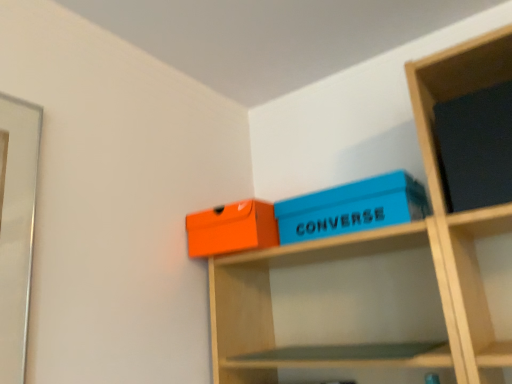
What is the approximate width of matte orange box at upper center, the 1th box viewed from the left?

It is 4.08 inches.

Locate an element on the screen. matte orange box at upper center, arranged as the second box when viewed from the right is located at coordinates (232, 228).

Could you measure the distance between blue matte shoebox at upper center, which ranks as the first box in right-to-left order, and matte orange box at upper center, the 1th box viewed from the left?

6.45 inches.

Does blue matte shoebox at upper center, which is counted as the 2th box, starting from the left, have a smaller size compared to matte orange box at upper center, the 1th box viewed from the left?

No, blue matte shoebox at upper center, which is counted as the 2th box, starting from the left, is not smaller than matte orange box at upper center, the 1th box viewed from the left.

Is blue matte shoebox at upper center, which ranks as the first box in right-to-left order, looking in the opposite direction of matte orange box at upper center, arranged as the second box when viewed from the right?

No, blue matte shoebox at upper center, which ranks as the first box in right-to-left order, is not facing the opposite direction of matte orange box at upper center, arranged as the second box when viewed from the right.

Which object is positioned more to the left, blue matte shoebox at upper center, which is counted as the 2th box, starting from the left, or matte orange box at upper center, arranged as the second box when viewed from the right?

matte orange box at upper center, arranged as the second box when viewed from the right, is more to the left.

Based on the photo, between matte orange box at upper center, the 1th box viewed from the left, and blue matte shoebox at upper center, which is counted as the 2th box, starting from the left, which one appears on the left side from the viewer's perspective?

Positioned to the left is matte orange box at upper center, the 1th box viewed from the left.

Based on their sizes in the image, would you say matte orange box at upper center, the 1th box viewed from the left, is bigger or smaller than blue matte shoebox at upper center, which ranks as the first box in right-to-left order?

Clearly, matte orange box at upper center, the 1th box viewed from the left, is smaller in size than blue matte shoebox at upper center, which ranks as the first box in right-to-left order.

Which object is closer to the camera taking this photo, matte orange box at upper center, the 1th box viewed from the left, or blue matte shoebox at upper center, which ranks as the first box in right-to-left order?

blue matte shoebox at upper center, which ranks as the first box in right-to-left order.

From a real-world perspective, does matte black book at upper right sit lower than matte orange box at upper center, the 1th box viewed from the left?

No, from a real-world perspective, matte black book at upper right is not under matte orange box at upper center, the 1th box viewed from the left.

Between matte black book at upper right and matte orange box at upper center, the 1th box viewed from the left, which one has smaller width?

Thinner between the two is matte black book at upper right.

Which box is the 2nd one when counting from the back of the matte black book at upper right? Please provide its 2D coordinates.

[(232, 228)]

Which object is positioned more to the left, matte black book at upper right or matte orange box at upper center, arranged as the second box when viewed from the right?

From the viewer's perspective, matte orange box at upper center, arranged as the second box when viewed from the right, appears more on the left side.

Would you consider matte black book at upper right to be distant from blue matte shoebox at upper center, which is counted as the 2th box, starting from the left?

No.

You are a GUI agent. You are given a task and a screenshot of the screen. Output one action in this format:
    pyautogui.click(x=<x>, y=<y>)
    Task: Click on the 1st box to the left when counting from the matte black book at upper right
    
    Given the screenshot: What is the action you would take?
    pyautogui.click(x=352, y=208)

Can blue matte shoebox at upper center, which ranks as the first box in right-to-left order, be found inside matte black book at upper right?

Definitely not — blue matte shoebox at upper center, which ranks as the first box in right-to-left order, is not inside matte black book at upper right.

Looking at their sizes, would you say matte orange box at upper center, the 1th box viewed from the left, is wider or thinner than matte black book at upper right?

Considering their sizes, matte orange box at upper center, the 1th box viewed from the left, looks broader than matte black book at upper right.

Can you confirm if matte orange box at upper center, the 1th box viewed from the left, is bigger than matte black book at upper right?

Actually, matte orange box at upper center, the 1th box viewed from the left, might be smaller than matte black book at upper right.

Considering the sizes of objects blue matte shoebox at upper center, which is counted as the 2th box, starting from the left, and matte black book at upper right in the image provided, who is smaller, blue matte shoebox at upper center, which is counted as the 2th box, starting from the left, or matte black book at upper right?

matte black book at upper right.

Starting from the matte black book at upper right, which box is the 1st one to the left? Please provide its 2D coordinates.

[(352, 208)]

From a real-world perspective, is blue matte shoebox at upper center, which is counted as the 2th box, starting from the left, positioned under matte black book at upper right based on gravity?

Yes, from a real-world perspective, blue matte shoebox at upper center, which is counted as the 2th box, starting from the left, is under matte black book at upper right.

Where is `box lying on the right of matte orange box at upper center, the 1th box viewed from the left`? The height and width of the screenshot is (384, 512). box lying on the right of matte orange box at upper center, the 1th box viewed from the left is located at coordinates (352, 208).

I want to click on box above the matte orange box at upper center, the 1th box viewed from the left (from the image's perspective), so click(x=352, y=208).

When comparing their distances from matte black book at upper right, does matte orange box at upper center, the 1th box viewed from the left, or blue matte shoebox at upper center, which ranks as the first box in right-to-left order, seem closer?

blue matte shoebox at upper center, which ranks as the first box in right-to-left order, is positioned closer to the anchor matte black book at upper right.

When comparing their distances from matte black book at upper right, does blue matte shoebox at upper center, which ranks as the first box in right-to-left order, or matte orange box at upper center, the 1th box viewed from the left, seem further?

matte orange box at upper center, the 1th box viewed from the left, is positioned further to the anchor matte black book at upper right.

Consider the image. Considering their positions, is matte black book at upper right positioned further to blue matte shoebox at upper center, which is counted as the 2th box, starting from the left, than matte orange box at upper center, arranged as the second box when viewed from the right?

Answer: matte black book at upper right is further to blue matte shoebox at upper center, which is counted as the 2th box, starting from the left.

Considering their positions, is blue matte shoebox at upper center, which ranks as the first box in right-to-left order, positioned closer to matte orange box at upper center, arranged as the second box when viewed from the right, than matte black book at upper right?

Among the two, blue matte shoebox at upper center, which ranks as the first box in right-to-left order, is located nearer to matte orange box at upper center, arranged as the second box when viewed from the right.

From the image, which object appears to be nearer to blue matte shoebox at upper center, which ranks as the first box in right-to-left order, matte orange box at upper center, the 1th box viewed from the left, or matte black book at upper right?

Among the two, matte orange box at upper center, the 1th box viewed from the left, is located nearer to blue matte shoebox at upper center, which ranks as the first box in right-to-left order.

Estimate the real-world distances between objects in this image. Which object is closer to matte orange box at upper center, the 1th box viewed from the left, matte black book at upper right or blue matte shoebox at upper center, which is counted as the 2th box, starting from the left?

Among the two, blue matte shoebox at upper center, which is counted as the 2th box, starting from the left, is located nearer to matte orange box at upper center, the 1th box viewed from the left.

The width and height of the screenshot is (512, 384). Identify the location of box between matte orange box at upper center, the 1th box viewed from the left, and matte black book at upper right. (352, 208).